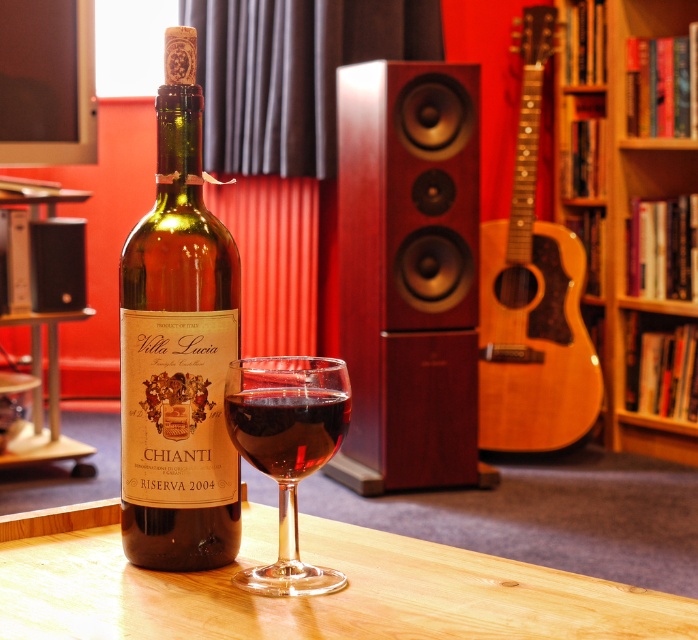
Who is taller, wooden bookshelf at center or light brown wooden guitar at right?

Standing taller between the two is wooden bookshelf at center.

Does wooden bookshelf at center have a greater width compared to light brown wooden guitar at right?

Indeed, wooden bookshelf at center has a greater width compared to light brown wooden guitar at right.

Between point (690, 157) and point (558, 308), which one is positioned in front?

Point (558, 308) is more forward.

What are the coordinates of `wooden bookshelf at center` in the screenshot? It's located at (638, 218).

At what (x,y) coordinates should I click in order to perform the action: click on brown wood table at center. Please return your answer as a coordinate pair (x, y). Looking at the image, I should click on (306, 596).

Based on the photo, between brown wood table at center and green glass bottle at center, which one has more height?

green glass bottle at center

Is point (505, 563) positioned after point (124, 445)?

Yes, point (505, 563) is farther from viewer.

This screenshot has height=640, width=698. In order to click on brown wood table at center in this screenshot , I will do `click(306, 596)`.

Is light brown wooden guitar at right thinner than wooden bookshelf at upper right?

No.

Can you confirm if light brown wooden guitar at right is bigger than wooden bookshelf at upper right?

Correct, light brown wooden guitar at right is larger in size than wooden bookshelf at upper right.

At what (x,y) coordinates should I click in order to perform the action: click on light brown wooden guitar at right. Please return your answer as a coordinate pair (x, y). This screenshot has height=640, width=698. Looking at the image, I should click on (533, 298).